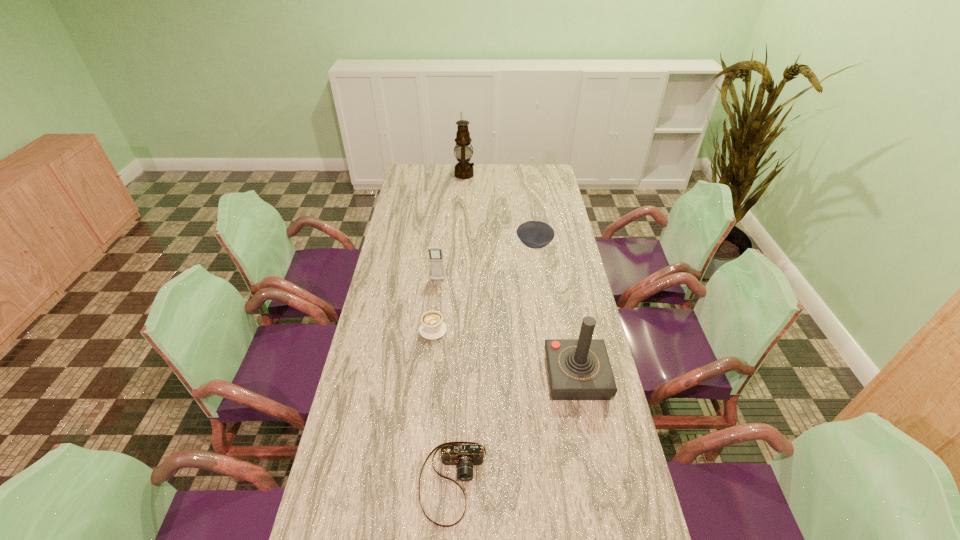
You are a GUI agent. You are given a task and a screenshot of the screen. Output one action in this format:
    pyautogui.click(x=<x>, y=<y>)
    Task: Click on the vacant space in between the tallest object and the fourth shortest object
    This screenshot has height=540, width=960.
    Given the screenshot: What is the action you would take?
    pyautogui.click(x=451, y=228)

You are a GUI agent. You are given a task and a screenshot of the screen. Output one action in this format:
    pyautogui.click(x=<x>, y=<y>)
    Task: Click on the vacant region between the oil lamp and the fourth farthest object
    
    Given the screenshot: What is the action you would take?
    pyautogui.click(x=448, y=252)

Find the location of a particular element. This screenshot has height=540, width=960. vacant area that lies between the cellular telephone and the cappuccino is located at coordinates (436, 305).

Identify which object is the second nearest to the camera. Please provide its 2D coordinates. Your answer should be formatted as a tuple, i.e. [(x, y)], where the tuple contains the x and y coordinates of a point satisfying the conditions above.

[(432, 327)]

This screenshot has height=540, width=960. What are the coordinates of `the third closest object to the bowl` in the screenshot? It's located at (463, 169).

Where is `vacant region that satisfies the following two spatial constraints: 1. to the right of the cappuccino's handle; 2. on the right side of the second farthest object`? The image size is (960, 540). vacant region that satisfies the following two spatial constraints: 1. to the right of the cappuccino's handle; 2. on the right side of the second farthest object is located at coordinates (442, 245).